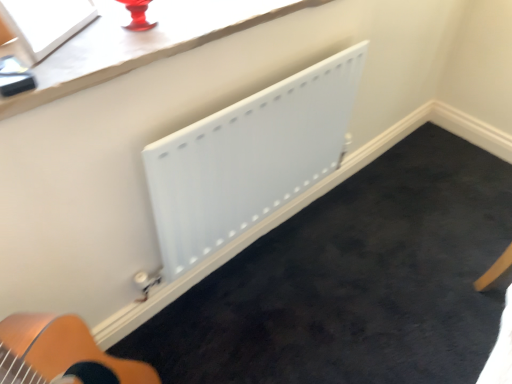
Question: Considering the relative sizes of white glossy window screen at upper left and white matte radiator at center in the image provided, is white glossy window screen at upper left shorter than white matte radiator at center?

Choices:
 (A) yes
 (B) no

Answer: (A)

Question: Is there a large distance between white glossy window screen at upper left and white matte radiator at center?

Choices:
 (A) no
 (B) yes

Answer: (A)

Question: Can you confirm if white glossy window screen at upper left is smaller than white matte radiator at center?

Choices:
 (A) yes
 (B) no

Answer: (A)

Question: From the image's perspective, does white glossy window screen at upper left appear higher than white matte radiator at center?

Choices:
 (A) no
 (B) yes

Answer: (B)

Question: Is white glossy window screen at upper left looking in the opposite direction of white matte radiator at center?

Choices:
 (A) yes
 (B) no

Answer: (B)

Question: From a real-world perspective, is white glossy window screen at upper left positioned over white matte radiator at center based on gravity?

Choices:
 (A) no
 (B) yes

Answer: (B)

Question: Is white matte radiator at center wider than white glossy window screen at upper left?

Choices:
 (A) no
 (B) yes

Answer: (A)

Question: Is white matte radiator at center facing towards white glossy window screen at upper left?

Choices:
 (A) no
 (B) yes

Answer: (A)

Question: Is white matte radiator at center smaller than white glossy window screen at upper left?

Choices:
 (A) no
 (B) yes

Answer: (A)

Question: Is white matte radiator at center positioned behind white glossy window screen at upper left?

Choices:
 (A) no
 (B) yes

Answer: (B)

Question: Is white glossy window screen at upper left at the back of white matte radiator at center?

Choices:
 (A) yes
 (B) no

Answer: (B)

Question: Is white matte radiator at center not within white glossy window screen at upper left?

Choices:
 (A) no
 (B) yes

Answer: (B)

Question: Is white glossy window screen at upper left wider or thinner than white matte radiator at center?

Choices:
 (A) thin
 (B) wide

Answer: (B)